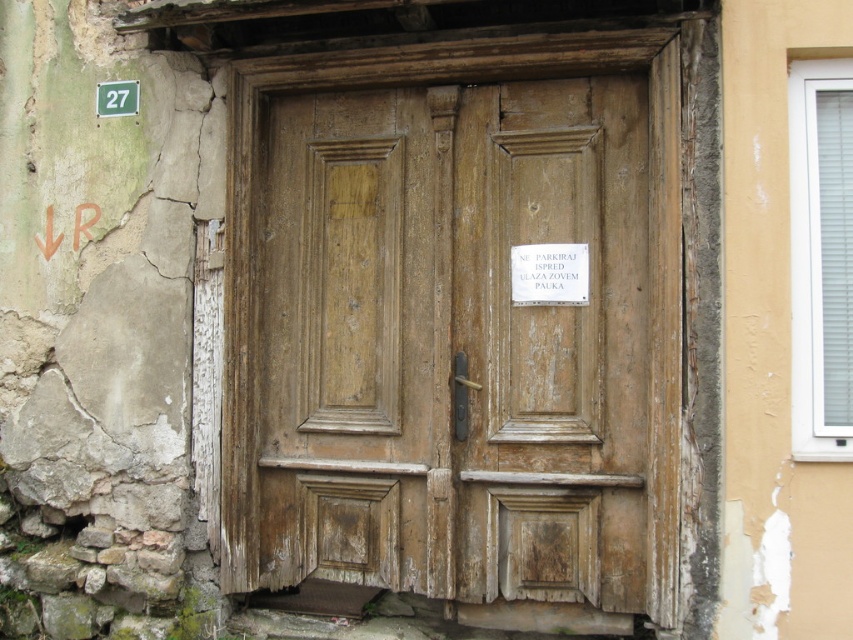
You are a delivery person holding a package for apartment 27. You see the weathered wood door at center and the green plastic sign at upper left. How far apart are these two items?

The distance between the weathered wood door at center and the green plastic sign at upper left is 4.47 feet.

You are a delivery person trying to find apartment number 27. You see the weathered wood door at center and the green plastic sign at upper left. According to the scene, which object is located to the right of the other?

The weathered wood door at center is to the right of the green plastic sign at upper left.

You are standing in front of the aged wooden door. There is a point at coordinates (456, 323). Can you tell me what surface this point is on?

The point at coordinates (456, 323) is on the weathered wood door at center.